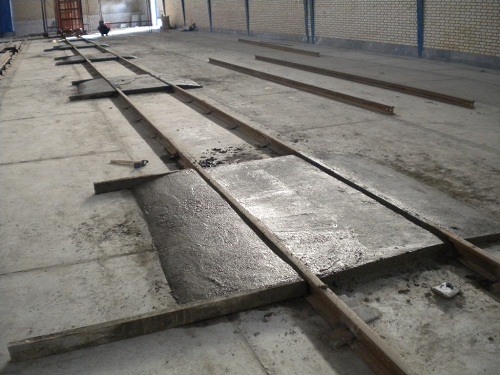
At what (x,y) coordinates should I click in order to perform the action: click on wood planks. Please return your answer as a coordinate pair (x, y). The image size is (500, 375). Looking at the image, I should click on (354, 100), (379, 83), (277, 46).